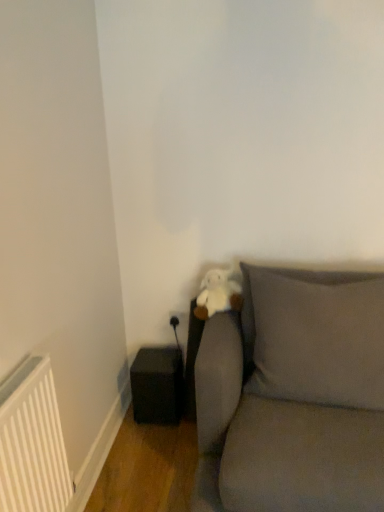
Question: Do you think gray fabric couch at lower right is within black matte speaker at lower left, or outside of it?

Choices:
 (A) outside
 (B) inside

Answer: (A)

Question: Considering the positions of gray fabric couch at lower right and black matte speaker at lower left in the image, is gray fabric couch at lower right taller or shorter than black matte speaker at lower left?

Choices:
 (A) tall
 (B) short

Answer: (A)

Question: Which object is positioned closest to the matte gray pillow at center?

Choices:
 (A) black matte speaker at lower left
 (B) white matte radiator at lower left
 (C) gray fabric couch at lower right
 (D) white plush toy at center

Answer: (C)

Question: Which is nearer to the matte gray pillow at center?

Choices:
 (A) white matte radiator at lower left
 (B) gray fabric couch at lower right
 (C) black matte speaker at lower left
 (D) white plush toy at center

Answer: (B)